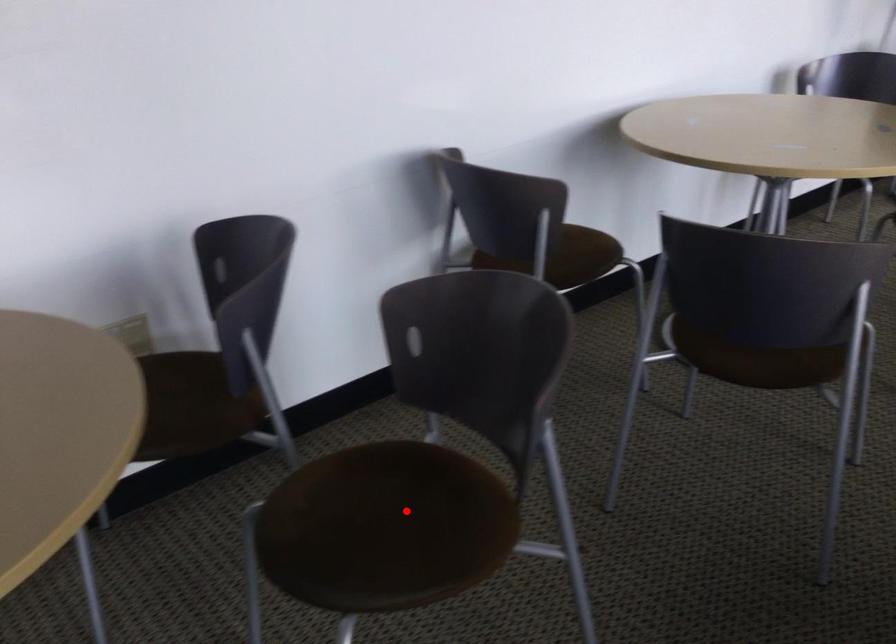
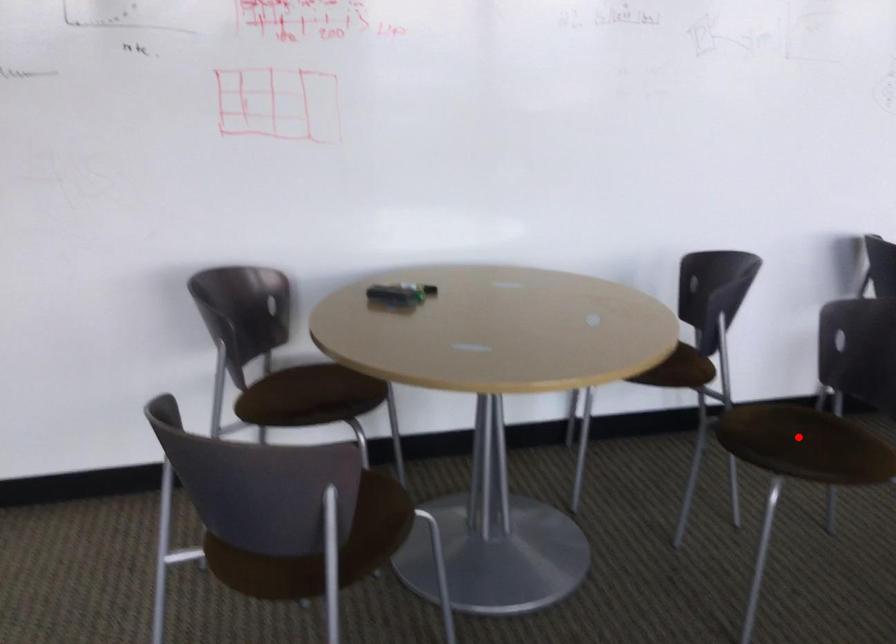
I am providing you with two images of the same scene from different viewpoints. A red point is marked on the first image and another point is marked on the second image. Is the red point in image1 aligned with the point shown in image2?

Yes